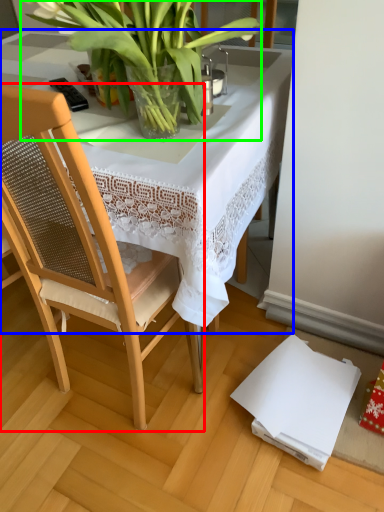
Question: Estimate the real-world distances between objects in this image. Which object is farther from chair (highlighted by a red box), table (highlighted by a blue box) or houseplant (highlighted by a green box)?

Choices:
 (A) table
 (B) houseplant

Answer: (B)